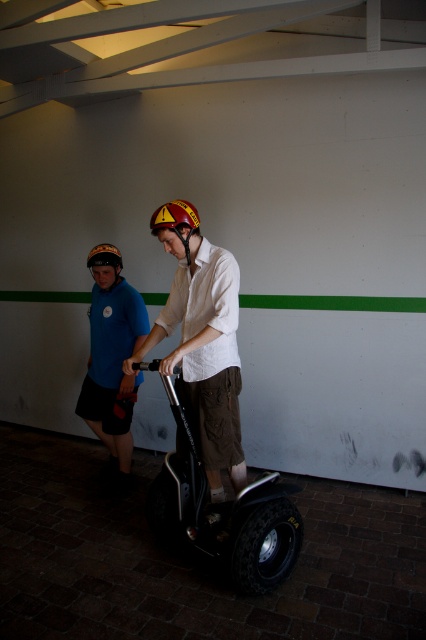
You are organizing a safety inspection for Segway operators in the gymnasium. You need to ensure that all operators are wearing the correct safety gear. The safety manual states that the required safety gear must have a width of at least 1.2 meters to ensure visibility. Given that the matte white shirt at center and the matte blue shirt at left are both worn by Segway operators, which operator is compliant with the safety regulations based on their shirt width?

The matte white shirt at center has a larger width than the matte blue shirt at left. Since the safety regulation requires a minimum width of 1.2 meters, the matte white shirt at center would meet the requirement if its width is at least 1.2 meters. However, without knowing the exact width of the matte blue shirt at left, we cannot confirm its compliance. But based on the comparison, the matte white shirt at center is wider, so it is more likely to be compliant.